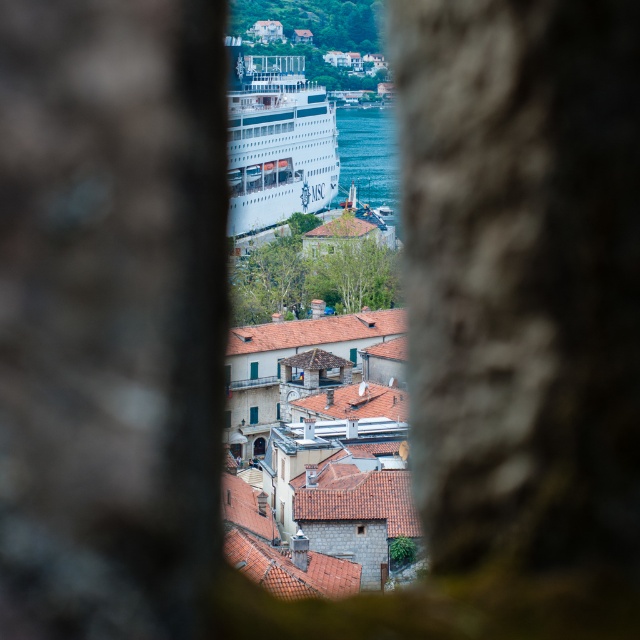
You are an interior designer looking at a wall with two glass windows. The blue glass window at center and the green glass window at center are part of a design project. Which window is located lower on the wall?

The blue glass window at center is positioned under the green glass window at center, so it is located lower on the wall.